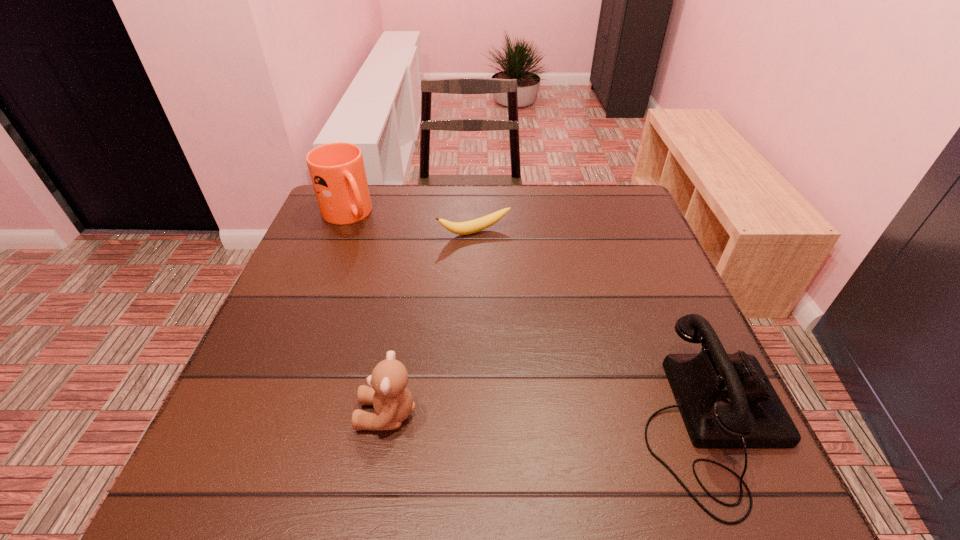
Find the location of a particular element. The height and width of the screenshot is (540, 960). object that is at the right edge is located at coordinates (726, 400).

At what (x,y) coordinates should I click in order to perform the action: click on object present at the far left corner. Please return your answer as a coordinate pair (x, y). The width and height of the screenshot is (960, 540). Looking at the image, I should click on (337, 171).

This screenshot has height=540, width=960. In order to click on object situated at the near right corner in this screenshot , I will do `click(726, 400)`.

At what (x,y) coordinates should I click in order to perform the action: click on free region at the far edge. Please return your answer as a coordinate pair (x, y). Looking at the image, I should click on (552, 185).

In the image, there is a desktop. Identify the location of vacant space at the near edge. This screenshot has width=960, height=540. (613, 399).

In the image, there is a desktop. Find the location of `free space at the left edge`. free space at the left edge is located at coordinates (319, 241).

Find the location of a particular element. The image size is (960, 540). vacant area at the right edge is located at coordinates (671, 389).

Find the location of a particular element. vacant area at the far right corner of the desktop is located at coordinates (628, 215).

This screenshot has height=540, width=960. In order to click on empty space between the leftmost object and the rightmost object in this screenshot , I will do `click(529, 319)`.

I want to click on vacant space that is in between the mug and the rightmost object, so click(x=529, y=319).